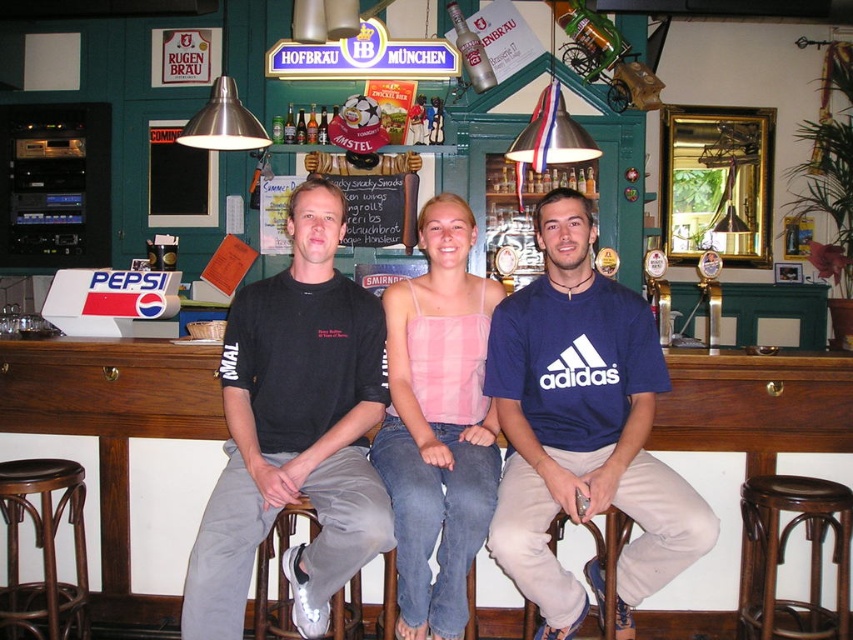
Looking at this image, who is more distant from viewer, (187,573) or (425,502)?

Point (187,573)

Which is above, black cotton t-shirt at center or pink fabric tank top at center?

black cotton t-shirt at center

Is point (320, 220) behind point (398, 282)?

No, it is in front of (398, 282).

Find the location of `black cotton t-shirt at center`. black cotton t-shirt at center is located at coordinates (294, 429).

Is pink fabric tank top at center smaller than brown wooden bar stool at lower center?

Actually, pink fabric tank top at center might be larger than brown wooden bar stool at lower center.

Who is more distant from viewer, (492, 458) or (543, 620)?

The point (543, 620) is more distant.

Between point (433, 218) and point (608, 611), which one is positioned behind?

Positioned behind is point (433, 218).

This screenshot has height=640, width=853. I want to click on pink fabric tank top at center, so (x=438, y=422).

Is point (521, 316) positioned in front of point (0, 493)?

No, it is not.

What do you see at coordinates (582, 428) in the screenshot? I see `blue cotton t-shirt at center` at bounding box center [582, 428].

Locate an element on the screen. The height and width of the screenshot is (640, 853). blue cotton t-shirt at center is located at coordinates (582, 428).

Identify the location of blue cotton t-shirt at center. This screenshot has height=640, width=853. (582, 428).